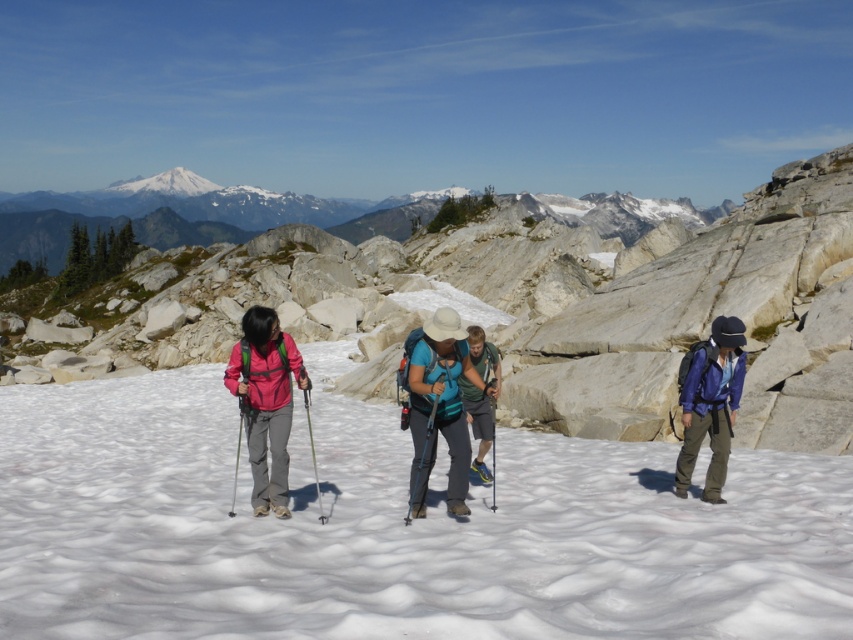
Question: Does white fluffy snow at center lie in front of blue fabric backpack at center?

Choices:
 (A) yes
 (B) no

Answer: (A)

Question: Among these points, which one is farthest from the camera?

Choices:
 (A) (466, 337)
 (B) (312, 448)
 (C) (815, 497)
 (D) (283, 374)

Answer: (A)

Question: Which point appears closest to the camera in this image?

Choices:
 (A) (421, 490)
 (B) (466, 326)

Answer: (A)

Question: Which point is farther to the camera?

Choices:
 (A) (705, 378)
 (B) (311, 445)
 (C) (527, 435)
 (D) (173, 348)

Answer: (D)

Question: Does matte blue shirt at center appear over matte blue jacket at right?

Choices:
 (A) no
 (B) yes

Answer: (B)

Question: Does matte blue jacket at right appear over matte black ski pole at center?

Choices:
 (A) yes
 (B) no

Answer: (A)